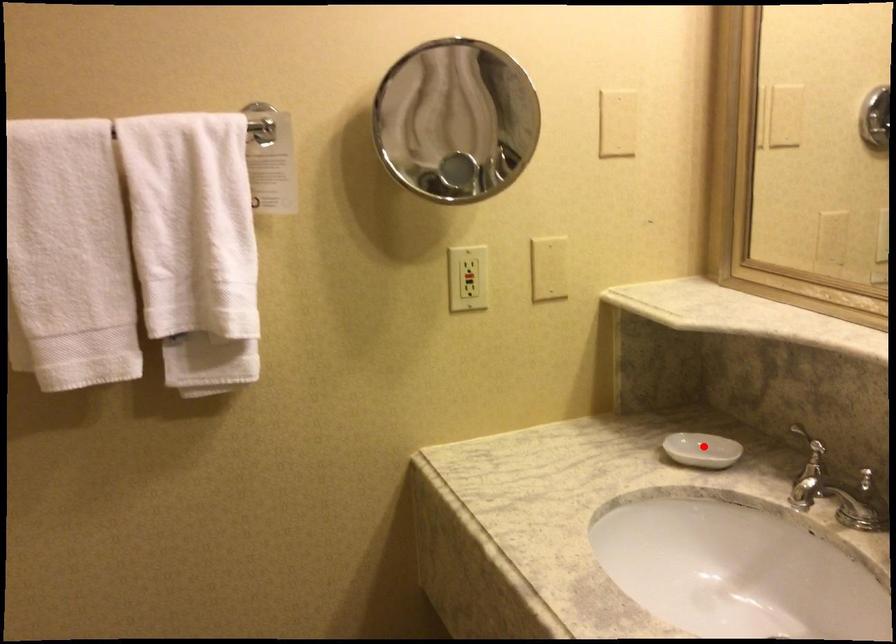
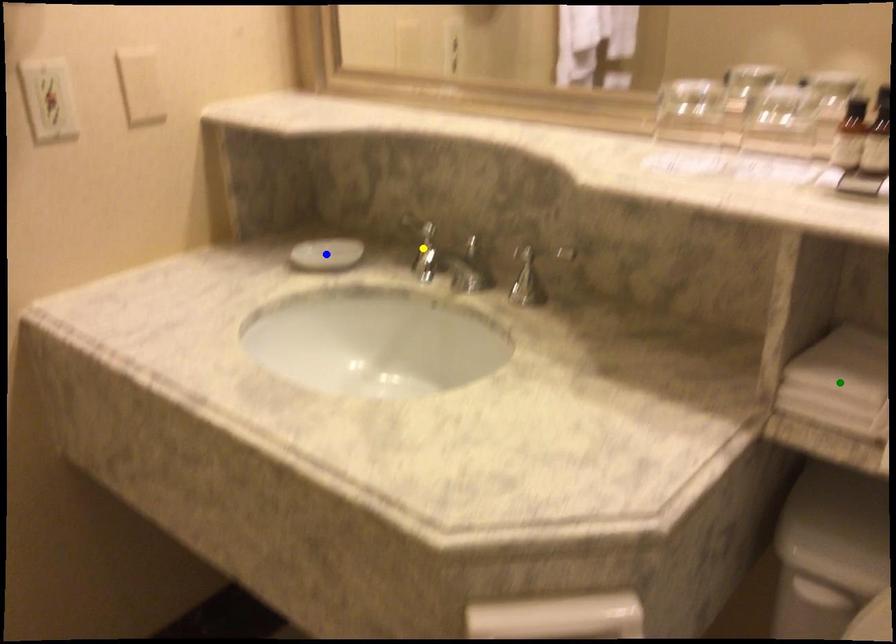
Question: I am providing you with two images of the same scene from different viewpoints. A red point is marked on the first image. You are given multiple points on the second image. Which point in image 2 represents the same 3d spot as the red point in image 1?

Choices:
 (A) green point
 (B) yellow point
 (C) blue point

Answer: (C)